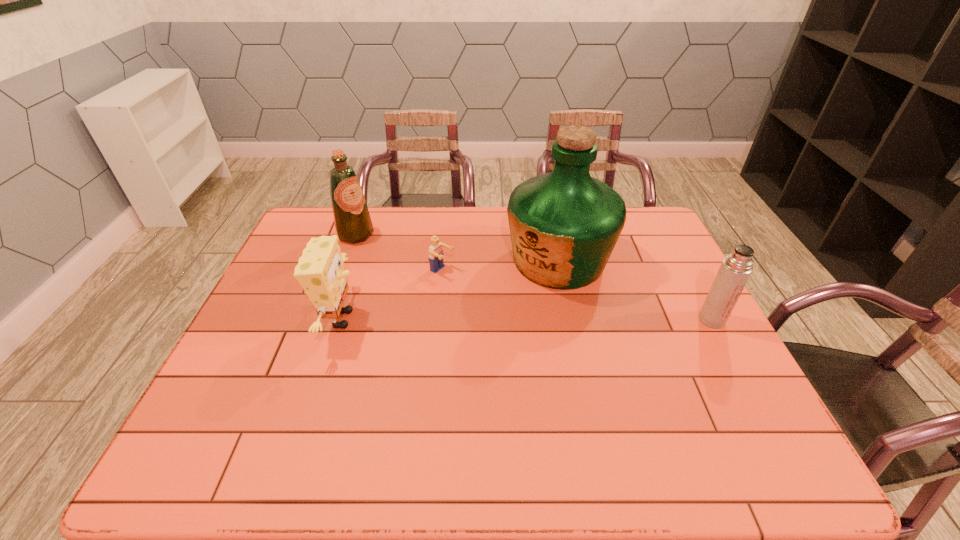
At what (x,y) coordinates should I click in order to perform the action: click on free spot on the desktop that is between the sponge and the thermos bottle and is positioned on the face of the shortest object. Please return your answer as a coordinate pair (x, y). Looking at the image, I should click on (534, 319).

At what (x,y) coordinates should I click in order to perform the action: click on free space on the desktop that is between the sponge and the rightmost object and is positioned on the label side of the tallest object. Please return your answer as a coordinate pair (x, y). The height and width of the screenshot is (540, 960). Looking at the image, I should click on (476, 319).

You are a GUI agent. You are given a task and a screenshot of the screen. Output one action in this format:
    pyautogui.click(x=<x>, y=<y>)
    Task: Click on the vacant space on the desktop that is between the sponge and the rightmost object and is positioned on the front-facing side of the olive oil
    
    Given the screenshot: What is the action you would take?
    pyautogui.click(x=479, y=319)